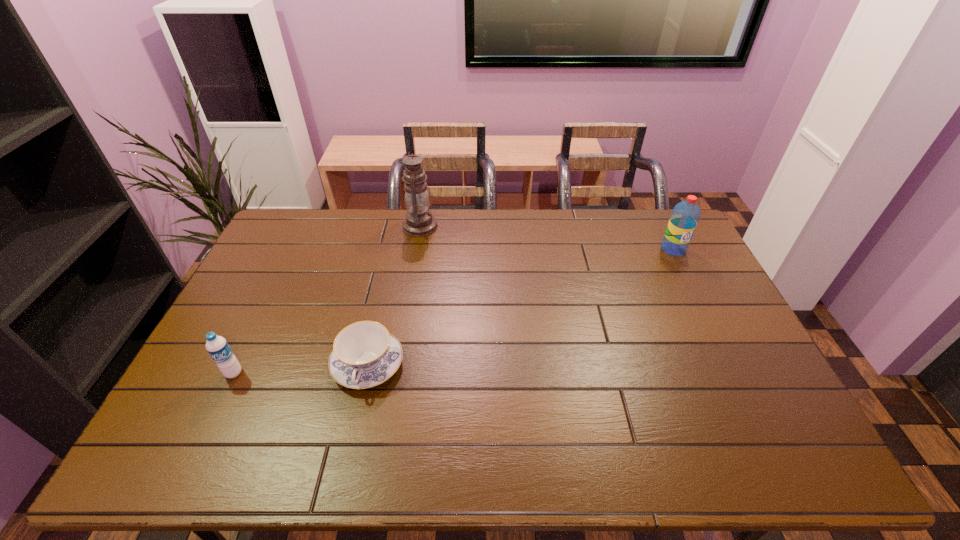
At what (x,y) coordinates should I click in order to perform the action: click on free space located 0.050m with the handle on the side of the shortest object. Please return your answer as a coordinate pair (x, y). The width and height of the screenshot is (960, 540). Looking at the image, I should click on (x=356, y=415).

Image resolution: width=960 pixels, height=540 pixels. Identify the location of oil lamp that is positioned at the far edge. (419, 221).

You are a GUI agent. You are given a task and a screenshot of the screen. Output one action in this format:
    pyautogui.click(x=<x>, y=<y>)
    Task: Click on the water bottle that is at the far edge
    
    Given the screenshot: What is the action you would take?
    pyautogui.click(x=685, y=216)

Where is `object positioned at the left edge`? object positioned at the left edge is located at coordinates (218, 348).

What are the coordinates of `object that is at the right edge` in the screenshot? It's located at (685, 216).

Where is `object that is positioned at the far right corner`? object that is positioned at the far right corner is located at coordinates (685, 216).

The image size is (960, 540). In the image, there is a desktop. What are the coordinates of `vacant space at the far edge` in the screenshot? It's located at (598, 233).

This screenshot has height=540, width=960. In the image, there is a desktop. Identify the location of vacant space at the near edge. (684, 454).

This screenshot has height=540, width=960. I want to click on free space at the left edge, so click(214, 418).

Where is `vacant position at the right edge of the desktop`? vacant position at the right edge of the desktop is located at coordinates (688, 310).